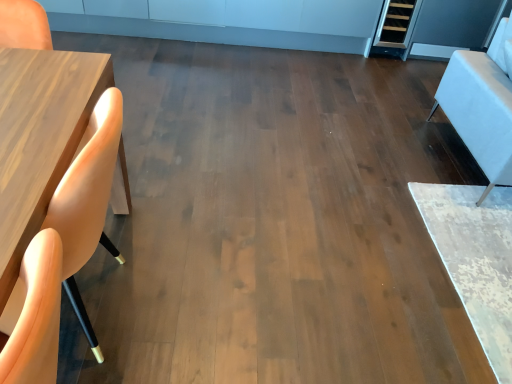
This screenshot has height=384, width=512. I want to click on vacant space positioned to the left of white leather armchair at right, so click(x=360, y=168).